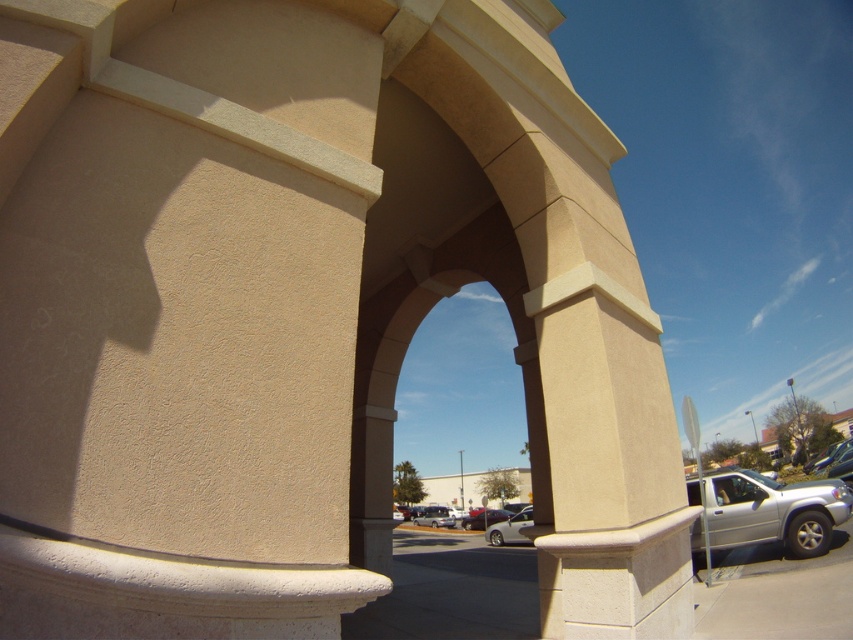
Question: In this image, where is silver metallic car at center located relative to silver metallic bus at center?

Choices:
 (A) right
 (B) left

Answer: (A)

Question: Which object is the farthest from the silver metallic car at center?

Choices:
 (A) metallic silver sedan at center
 (B) silver metallic truck at lower right

Answer: (B)

Question: Which object is the farthest from the silver metallic bus at center?

Choices:
 (A) metallic silver sedan at center
 (B) silver metallic car at center

Answer: (B)

Question: Is silver metallic truck at lower right positioned before silver metallic bus at center?

Choices:
 (A) no
 (B) yes

Answer: (B)

Question: Which point is farther to the camera?

Choices:
 (A) metallic silver sedan at center
 (B) silver metallic truck at lower right
 (C) silver metallic bus at center

Answer: (C)

Question: Does silver metallic car at center have a smaller size compared to silver metallic bus at center?

Choices:
 (A) no
 (B) yes

Answer: (A)